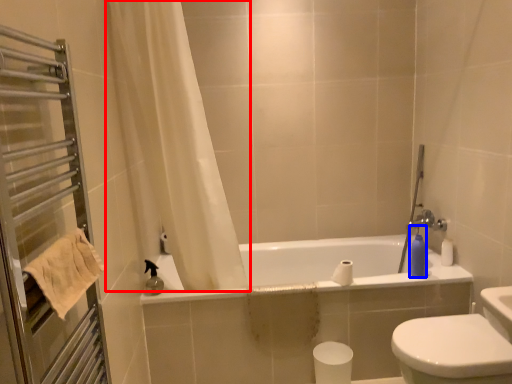
Question: Which object appears closest to the camera in this image, curtain (highlighted by a red box) or soap dispenser (highlighted by a blue box)?

Choices:
 (A) curtain
 (B) soap dispenser

Answer: (A)